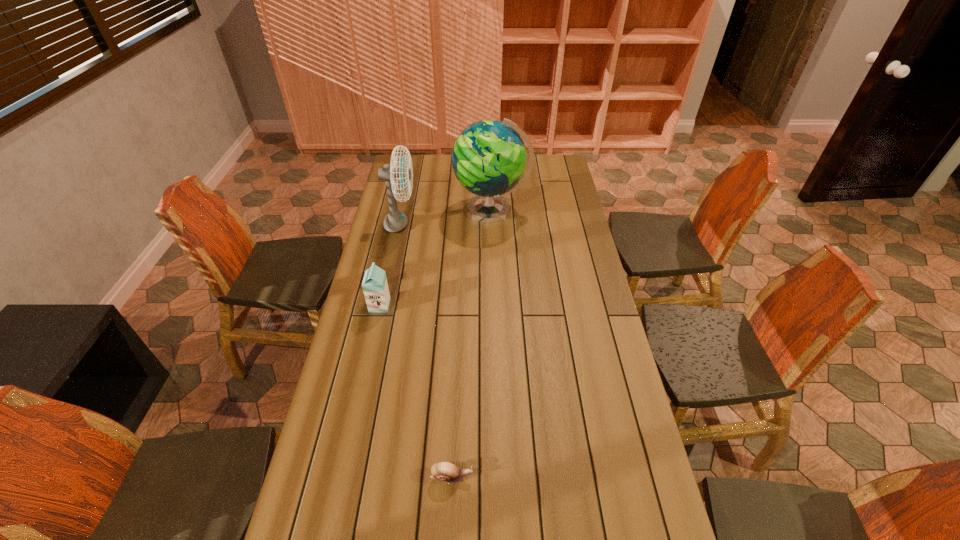
Where is `free space located on the right of the third farthest object`? free space located on the right of the third farthest object is located at coordinates (444, 305).

This screenshot has height=540, width=960. I want to click on blank area located 0.220m on the front-facing side of the nearest object, so click(x=556, y=477).

Image resolution: width=960 pixels, height=540 pixels. Identify the location of fan that is at the left edge. (395, 220).

Identify the location of milk carton located at the left edge. The width and height of the screenshot is (960, 540). (375, 287).

This screenshot has width=960, height=540. In the image, there is a desktop. Find the location of `vacant space at the left edge`. vacant space at the left edge is located at coordinates (367, 319).

In the image, there is a desktop. Identify the location of vacant area at the right edge. (630, 517).

This screenshot has height=540, width=960. Find the location of `vacant area at the far right corner`. vacant area at the far right corner is located at coordinates (566, 167).

At what (x,y) coordinates should I click in order to perform the action: click on unoccupied area between the globe and the fan. Please return your answer as a coordinate pair (x, y). Looking at the image, I should click on (445, 218).

Locate an element on the screen. The image size is (960, 540). free space between the tallest object and the milk carton is located at coordinates (436, 258).

The width and height of the screenshot is (960, 540). I want to click on free space between the globe and the second shortest object, so click(436, 258).